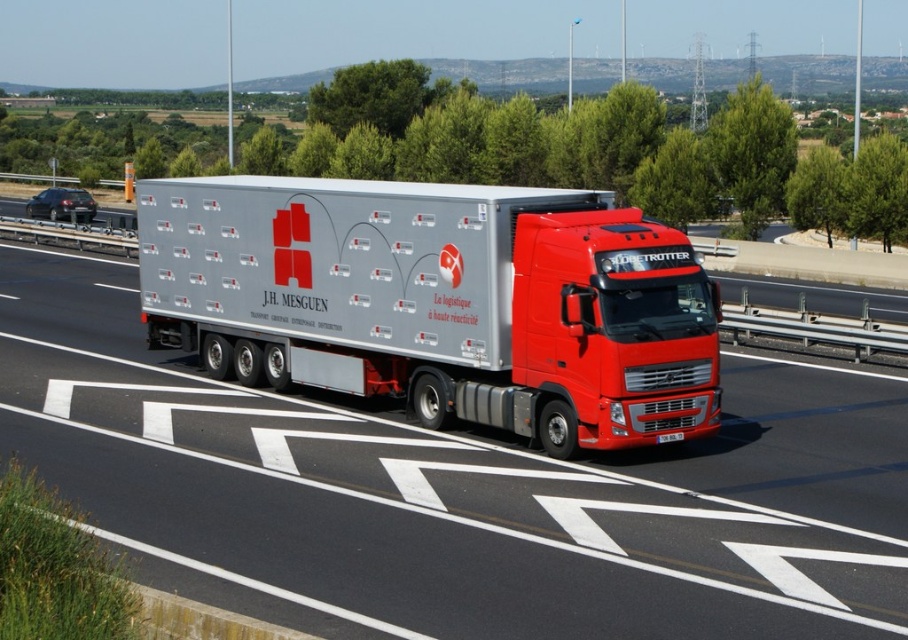
Question: Among these objects, which one is farthest from the camera?

Choices:
 (A) silver metallic trailer truck at center
 (B) silver metallic truck at center

Answer: (A)

Question: Can you confirm if silver metallic truck at center is positioned to the right of silver metallic trailer truck at center?

Choices:
 (A) yes
 (B) no

Answer: (B)

Question: Does silver metallic truck at center appear on the right side of silver metallic trailer truck at center?

Choices:
 (A) yes
 (B) no

Answer: (B)

Question: Which point is closer to the camera?

Choices:
 (A) silver metallic truck at center
 (B) silver metallic trailer truck at center

Answer: (A)

Question: Is silver metallic truck at center smaller than silver metallic trailer truck at center?

Choices:
 (A) no
 (B) yes

Answer: (A)